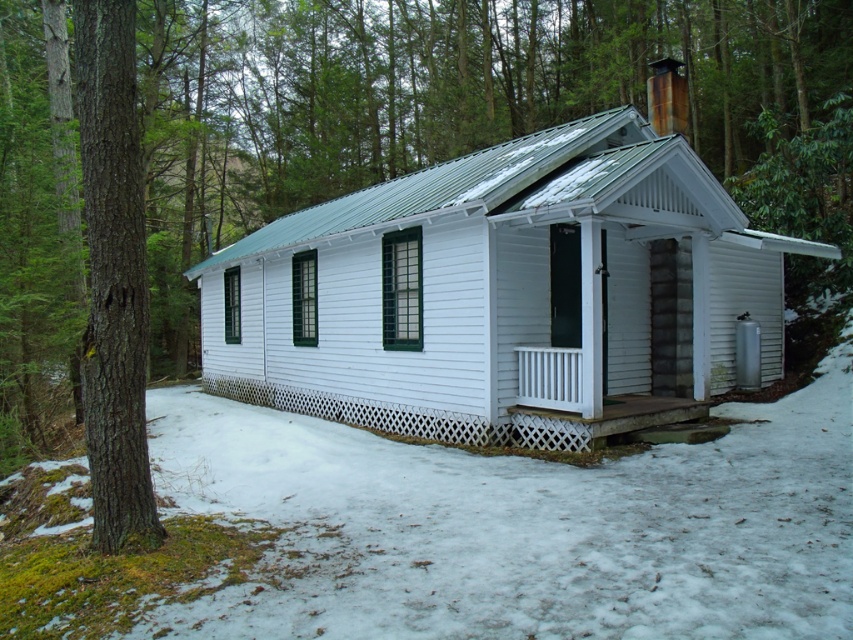
You are standing in front of the cabin and see a point marked at coordinates (113, 276). Based on the scene description, can you identify what object this point is located on?

The point is located on the brown rough bark tree at left.

You are standing on the ground near the brown rough bark tree at left and want to walk to the white wooden cabin at center. Which direction should you move relative to the tree?

The white wooden cabin at center is located above the brown rough bark tree at left, so you should move upward from the tree to reach the cabin.